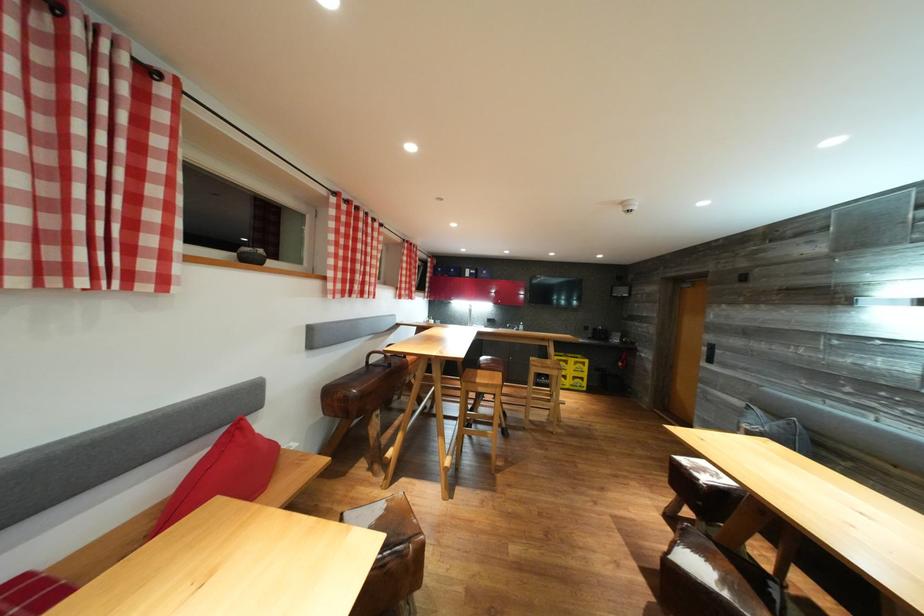
Image resolution: width=924 pixels, height=616 pixels. What do you see at coordinates (250, 254) in the screenshot? I see `the small black bowl` at bounding box center [250, 254].